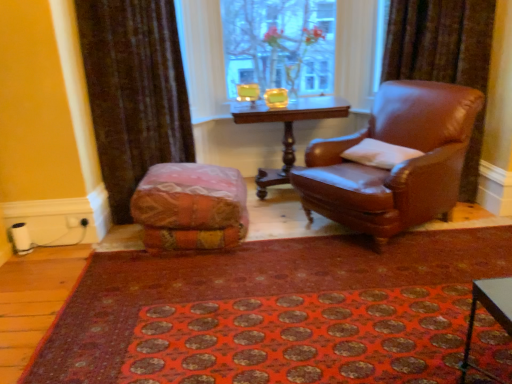
Question: Is textured multicolored bean bag at center positioned with its back to red carpet at center?

Choices:
 (A) no
 (B) yes

Answer: (A)

Question: Does textured multicolored bean bag at center have a lesser width compared to red carpet at center?

Choices:
 (A) yes
 (B) no

Answer: (A)

Question: Does textured multicolored bean bag at center have a lesser height compared to red carpet at center?

Choices:
 (A) no
 (B) yes

Answer: (A)

Question: Can you confirm if textured multicolored bean bag at center is wider than red carpet at center?

Choices:
 (A) no
 (B) yes

Answer: (A)

Question: From a real-world perspective, is textured multicolored bean bag at center under red carpet at center?

Choices:
 (A) no
 (B) yes

Answer: (A)

Question: Is textured multicolored bean bag at center positioned before red carpet at center?

Choices:
 (A) no
 (B) yes

Answer: (A)

Question: Is textured multicolored bean bag at center beside transparent glass vase at upper center?

Choices:
 (A) yes
 (B) no

Answer: (B)

Question: From a real-world perspective, is textured multicolored bean bag at center positioned over transparent glass vase at upper center based on gravity?

Choices:
 (A) no
 (B) yes

Answer: (A)

Question: From the image's perspective, would you say textured multicolored bean bag at center is shown under transparent glass vase at upper center?

Choices:
 (A) no
 (B) yes

Answer: (B)

Question: Is textured multicolored bean bag at center thinner than transparent glass vase at upper center?

Choices:
 (A) no
 (B) yes

Answer: (A)

Question: Is textured multicolored bean bag at center to the left of transparent glass vase at upper center from the viewer's perspective?

Choices:
 (A) no
 (B) yes

Answer: (B)

Question: Does textured multicolored bean bag at center have a greater width compared to transparent glass vase at upper center?

Choices:
 (A) no
 (B) yes

Answer: (B)

Question: From a real-world perspective, does brown leather chair at right sit lower than white soft pillow at right?

Choices:
 (A) yes
 (B) no

Answer: (A)